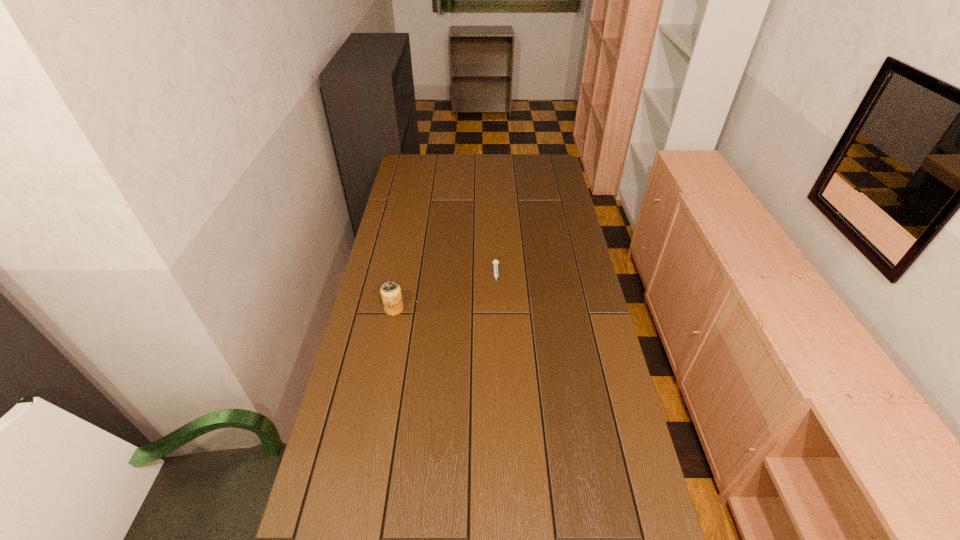
You are a GUI agent. You are given a task and a screenshot of the screen. Output one action in this format:
    pyautogui.click(x=<x>, y=<y>)
    Task: Click on the free space at the far right corner
    The width and height of the screenshot is (960, 540).
    Given the screenshot: What is the action you would take?
    pyautogui.click(x=554, y=172)